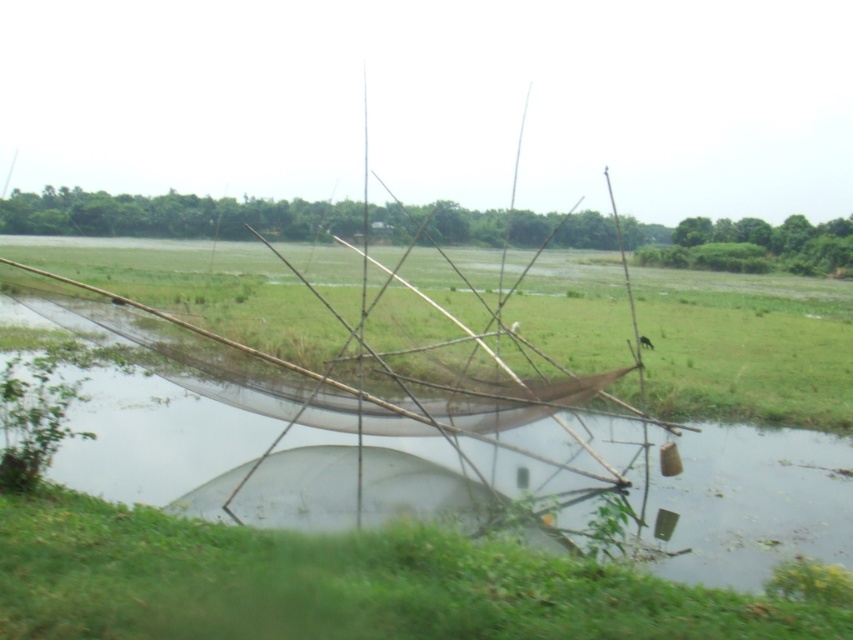
Question: Does green grass at lower left have a larger size compared to green grass at center?

Choices:
 (A) no
 (B) yes

Answer: (A)

Question: Is green grass at lower left positioned before green grass at center?

Choices:
 (A) yes
 (B) no

Answer: (A)

Question: Which of the following is the closest to the observer?

Choices:
 (A) (241, 561)
 (B) (715, 316)

Answer: (A)

Question: Is green grass at lower left to the left of green grass at center from the viewer's perspective?

Choices:
 (A) no
 (B) yes

Answer: (A)

Question: Among these points, which one is farthest from the camera?

Choices:
 (A) (286, 280)
 (B) (485, 564)

Answer: (A)

Question: Among these points, which one is farthest from the camera?

Choices:
 (A) (485, 268)
 (B) (120, 577)

Answer: (A)